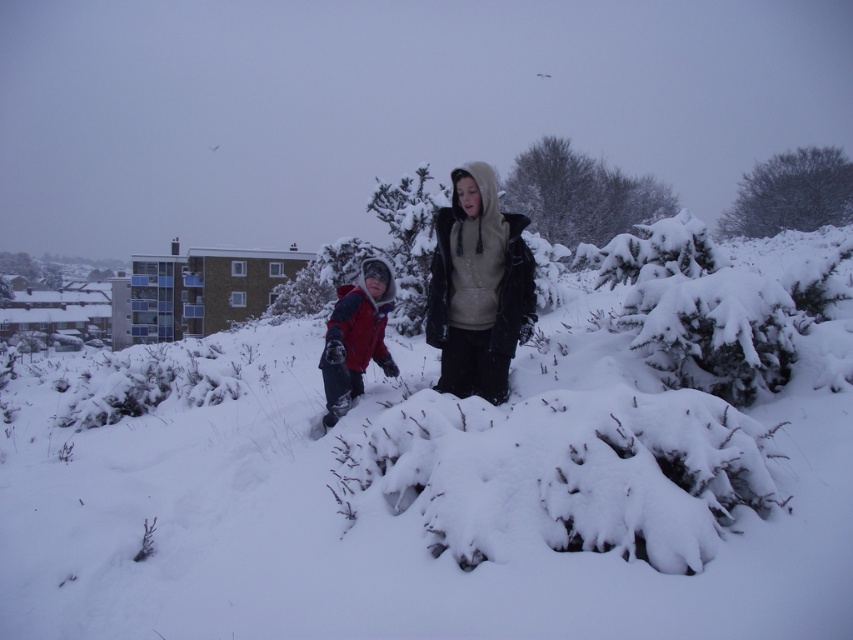
Question: Which of the following is the farthest from the observer?

Choices:
 (A) snow-covered tree at upper right
 (B) dark gray fleece jacket at center
 (C) matte red jacket at center

Answer: (A)

Question: Which point appears closest to the camera in this image?

Choices:
 (A) (665, 195)
 (B) (497, 392)

Answer: (B)

Question: Considering the real-world distances, which object is farthest from the snow-covered tree at upper right?

Choices:
 (A) dark gray fleece jacket at center
 (B) snow-covered bush at upper center
 (C) matte red jacket at center

Answer: (C)

Question: Can you confirm if dark gray fleece jacket at center is positioned to the left of matte red jacket at center?

Choices:
 (A) yes
 (B) no

Answer: (B)

Question: Can you confirm if snow-covered bush at upper center is positioned above matte red jacket at center?

Choices:
 (A) yes
 (B) no

Answer: (A)

Question: Is snow-covered tree at upper right below matte red jacket at center?

Choices:
 (A) yes
 (B) no

Answer: (B)